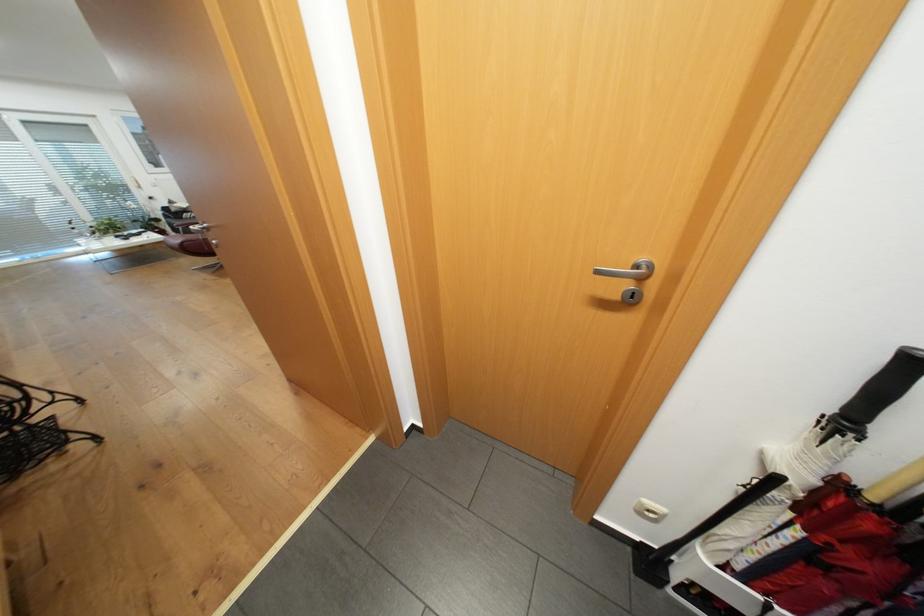
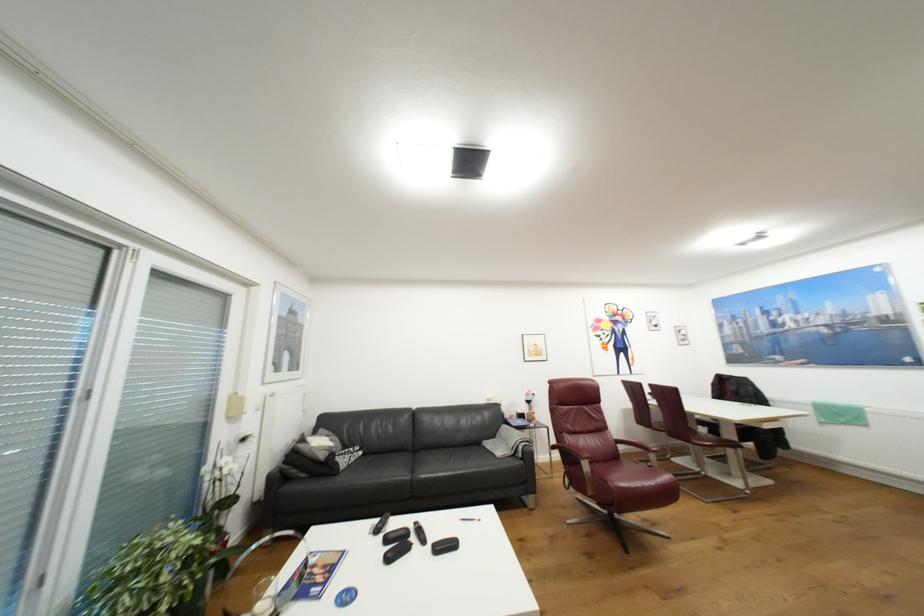
In the second image, find the point that corresponds to point 178,201 in the first image.

(309, 440)